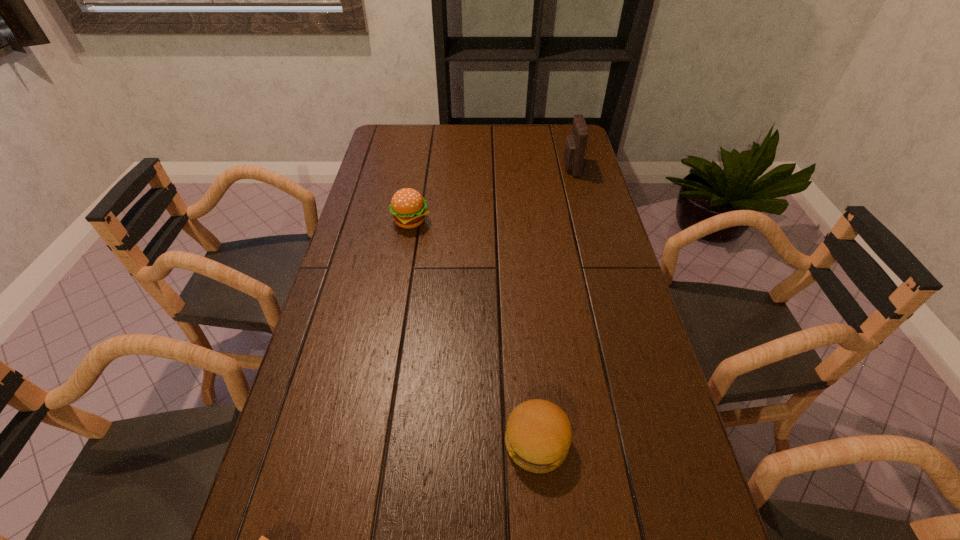
Identify the location of free space located on the back of the third object from left to right. (525, 314).

This screenshot has height=540, width=960. Identify the location of object that is at the left edge. (408, 207).

Identify the location of object present at the right edge. This screenshot has width=960, height=540. (575, 144).

Identify the location of blank area at the far edge. The height and width of the screenshot is (540, 960). (500, 147).

Locate an element on the screen. blank area at the left edge is located at coordinates (377, 173).

In the image, there is a desktop. Where is `free space at the right edge`? The image size is (960, 540). free space at the right edge is located at coordinates (620, 318).

Identify the location of free space that is in between the third object from right to left and the second object from right to left. The width and height of the screenshot is (960, 540). (473, 332).

Where is `free space between the second shortest hamburger and the third nearest object`? This screenshot has width=960, height=540. free space between the second shortest hamburger and the third nearest object is located at coordinates (473, 332).

Locate an element on the screen. The height and width of the screenshot is (540, 960). vacant area between the second nearest hamburger and the second object from left to right is located at coordinates (473, 332).

At what (x,y) coordinates should I click in order to perform the action: click on vacant area that lies between the second hamburger from left to right and the second farthest hamburger. Please return your answer as a coordinate pair (x, y). Looking at the image, I should click on [x=473, y=332].